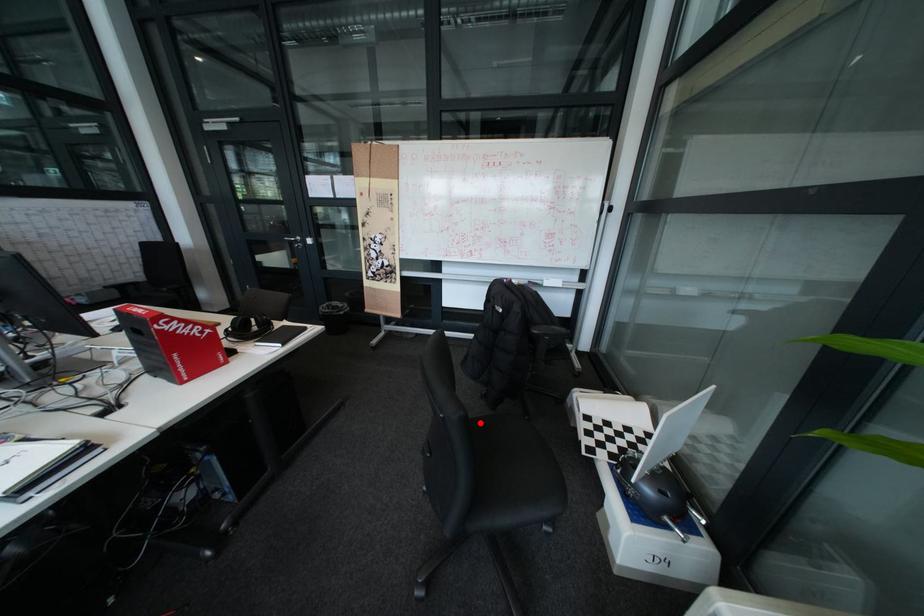
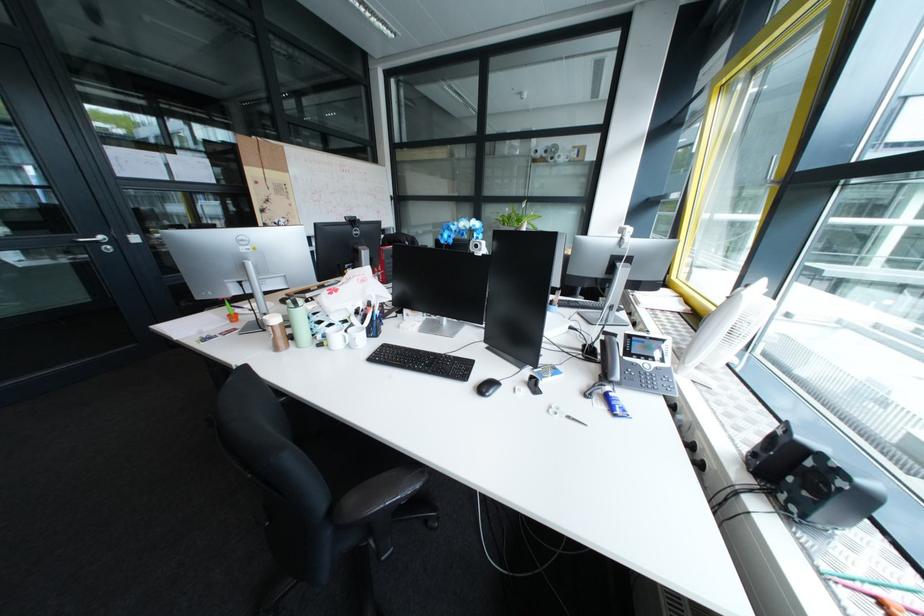
Question: I am providing you with two images of the same scene from different viewpoints. A red point is marked on the first image. Can you still see the location of the red point in image 2?

Choices:
 (A) Yes
 (B) No

Answer: (B)